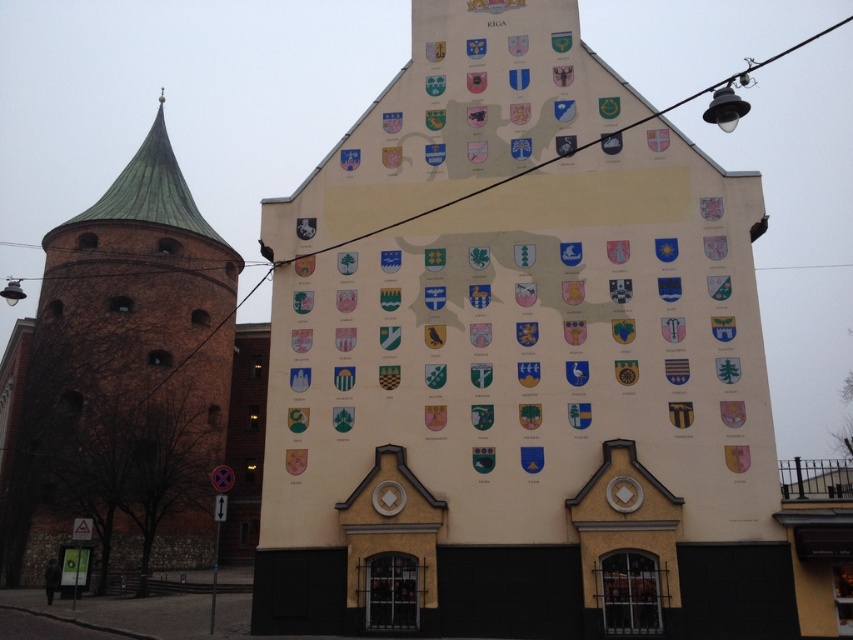
Does white painted wall at center have a smaller size compared to brown brick tower at left?

Indeed, white painted wall at center has a smaller size compared to brown brick tower at left.

The image size is (853, 640). What do you see at coordinates (517, 360) in the screenshot? I see `white painted wall at center` at bounding box center [517, 360].

Identify the location of white painted wall at center. (517, 360).